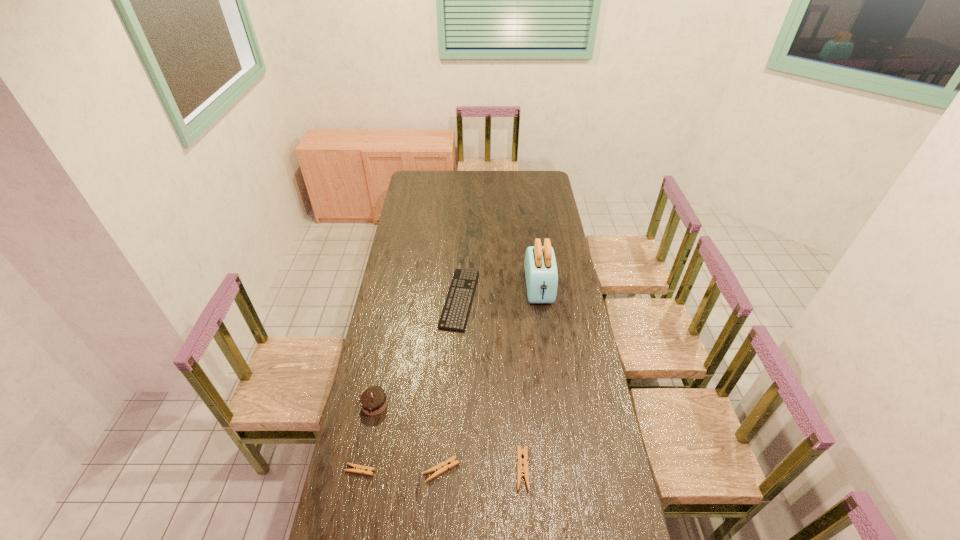
Locate an element on the screen. free region at the right edge is located at coordinates (583, 323).

Locate an element on the screen. The width and height of the screenshot is (960, 540). vacant space at the far left corner is located at coordinates (420, 185).

Identify the location of vacant space at the near right corner of the desktop. The image size is (960, 540). (601, 516).

Find the location of a particular element. The width and height of the screenshot is (960, 540). free area in between the leftmost clothespin and the computer keyboard is located at coordinates (410, 384).

You are a GUI agent. You are given a task and a screenshot of the screen. Output one action in this format:
    pyautogui.click(x=<x>, y=<y>)
    Task: Click on the unoccupied area between the second clothespin from right to left and the rightmost clothespin
    This screenshot has width=960, height=540.
    Given the screenshot: What is the action you would take?
    pyautogui.click(x=482, y=470)

In order to click on vacant space in between the toaster and the fourth shortest object in this screenshot , I will do `click(531, 379)`.

You are a GUI agent. You are given a task and a screenshot of the screen. Output one action in this format:
    pyautogui.click(x=<x>, y=<y>)
    Task: Click on the free space between the tallest clothespin and the computer keyboard
    
    Given the screenshot: What is the action you would take?
    pyautogui.click(x=491, y=384)

Locate an element on the screen. unoccupied position between the rightmost object and the leftmost clothespin is located at coordinates (449, 379).

Identify the location of free space that is in between the second tallest object and the computer keyboard. Image resolution: width=960 pixels, height=540 pixels. (417, 352).

Where is `free spot between the computer keyboard and the fourth nearest object`? This screenshot has height=540, width=960. free spot between the computer keyboard and the fourth nearest object is located at coordinates (417, 352).